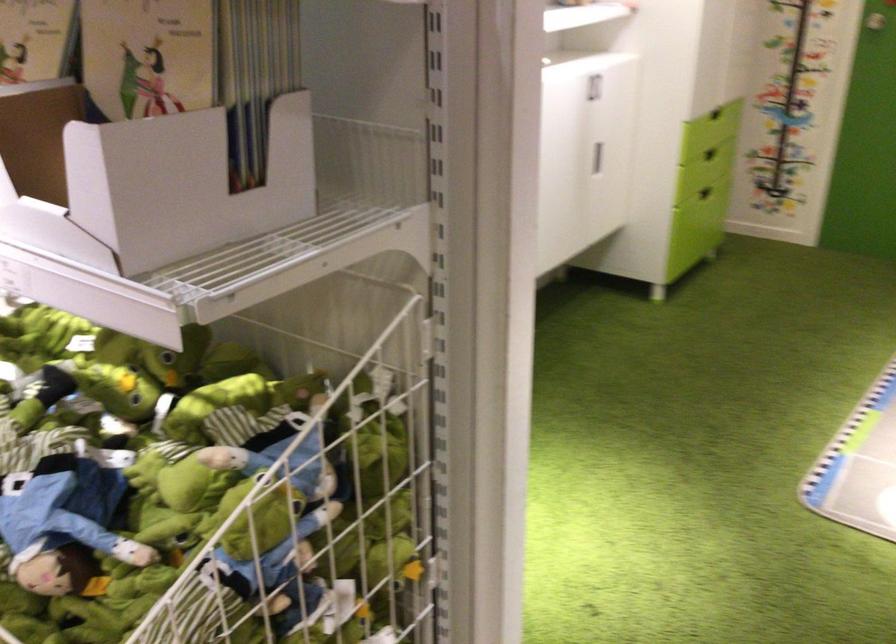
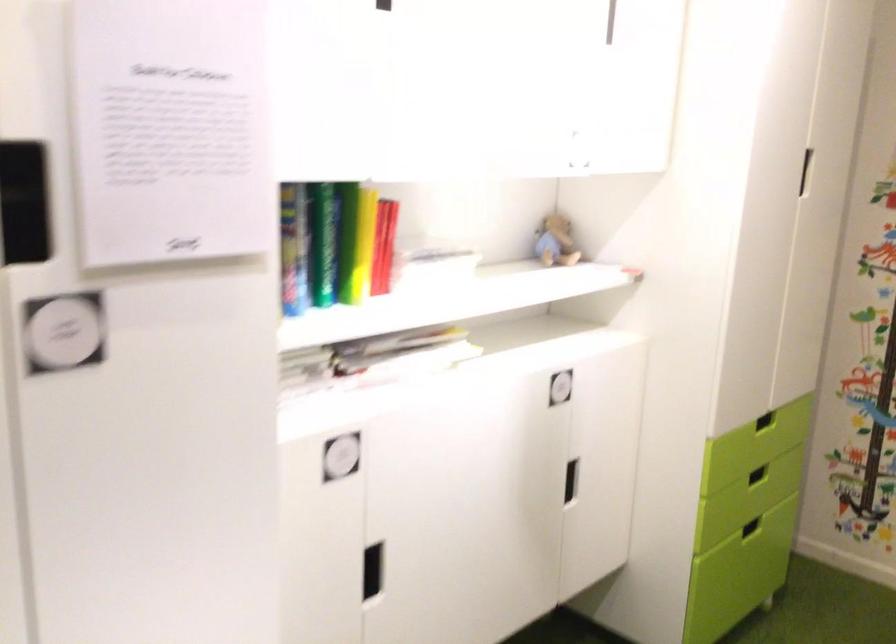
The images are taken continuously from a first-person perspective. In which direction are you moving?

The movement direction of the cameraman is right, forward.